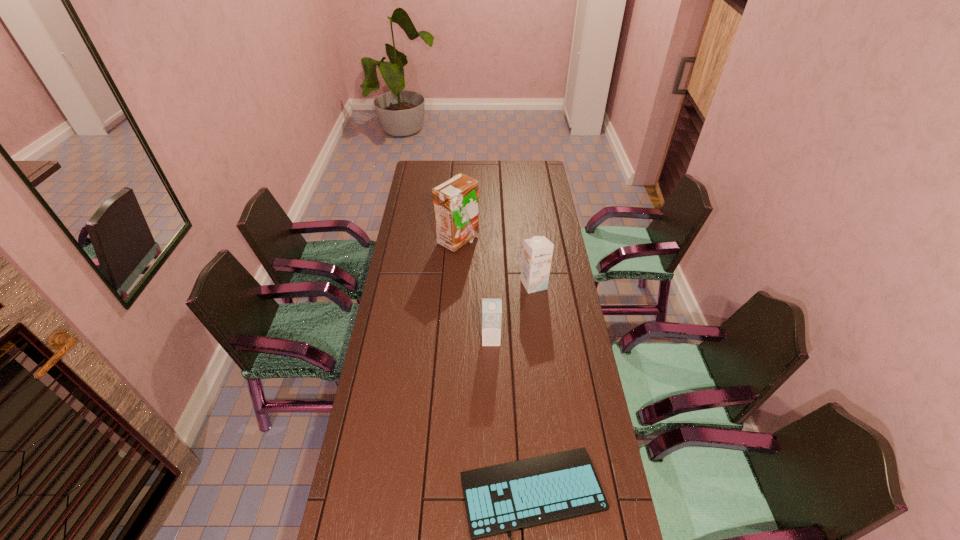
Find the location of `the farthest carton`. the farthest carton is located at coordinates (455, 201).

The width and height of the screenshot is (960, 540). Find the location of `the tallest object`. the tallest object is located at coordinates (455, 201).

Where is `the rightmost carton`? The width and height of the screenshot is (960, 540). the rightmost carton is located at coordinates (537, 251).

Locate an element on the screen. the second farthest object is located at coordinates (537, 251).

The image size is (960, 540). I want to click on the third farthest object, so (x=491, y=307).

I want to click on the nearest carton, so click(491, 307).

Locate an element on the screen. vacant region located 0.190m on the straw side of the farthest carton is located at coordinates (520, 241).

Find the location of a particular element. Image resolution: width=960 pixels, height=540 pixels. vacant space located 0.190m on the back of the third nearest object is located at coordinates (529, 247).

Find the location of a particular element. This screenshot has width=960, height=540. blank space located on the front label of the second carton from right to left is located at coordinates (492, 398).

Identify the location of object that is positioned at the right edge. (537, 251).